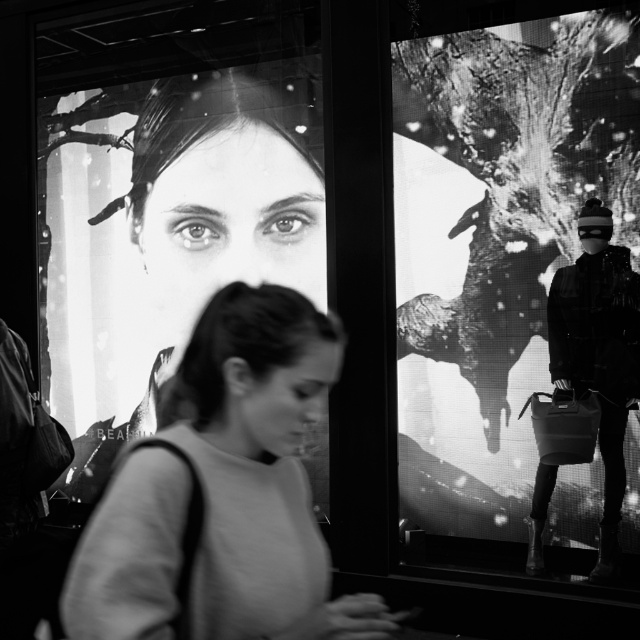
Between smooth gray sweater at center and black matte jacket at right, which one is positioned lower?

black matte jacket at right

Is smooth gray sweater at center closer to the viewer compared to black matte jacket at right?

Yes, it is in front of black matte jacket at right.

You are a GUI agent. You are given a task and a screenshot of the screen. Output one action in this format:
    pyautogui.click(x=<x>, y=<y>)
    Task: Click on the smooth gray sweater at center
    
    Given the screenshot: What is the action you would take?
    pyautogui.click(x=260, y=468)

Find the location of a particular element. The height and width of the screenshot is (640, 640). smooth gray sweater at center is located at coordinates (260, 468).

Who is positioned more to the left, smooth skin face at center or black matte jacket at right?

smooth skin face at center

Who is taller, smooth skin face at center or black matte jacket at right?

Standing taller between the two is smooth skin face at center.

What do you see at coordinates (209, 220) in the screenshot? Image resolution: width=640 pixels, height=640 pixels. I see `smooth skin face at center` at bounding box center [209, 220].

This screenshot has width=640, height=640. I want to click on smooth skin face at center, so click(209, 220).

Which is in front, point (262, 529) or point (136, 429)?

Point (262, 529) is more forward.

Between smooth gray sweater at center and smooth skin face at center, which one is positioned lower?

smooth gray sweater at center is lower down.

Locate an element on the screen. The image size is (640, 640). smooth gray sweater at center is located at coordinates (260, 468).